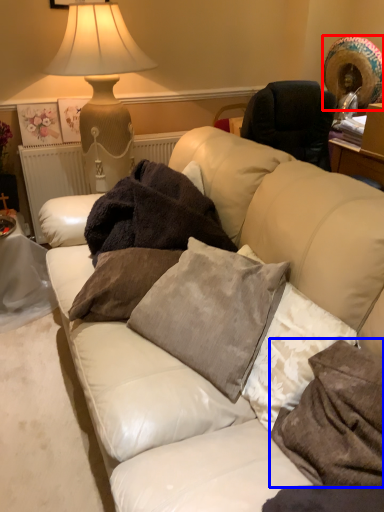
Question: Which of the following is the closest to the observer, straw hat (highlighted by a red box) or pillow (highlighted by a blue box)?

Choices:
 (A) straw hat
 (B) pillow

Answer: (B)